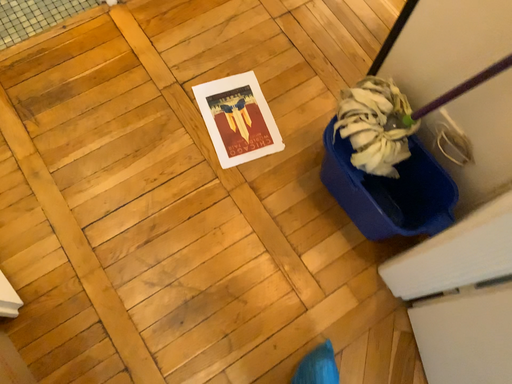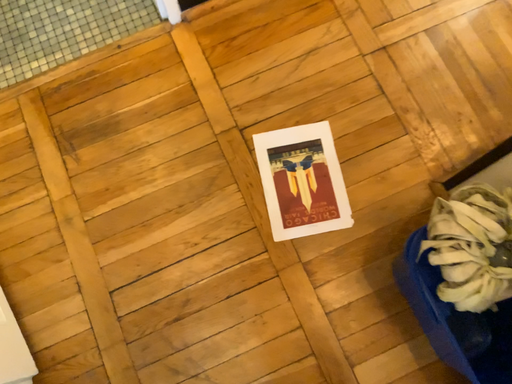
Question: Which way did the camera rotate in the video?

Choices:
 (A) rotated left
 (B) rotated right

Answer: (A)